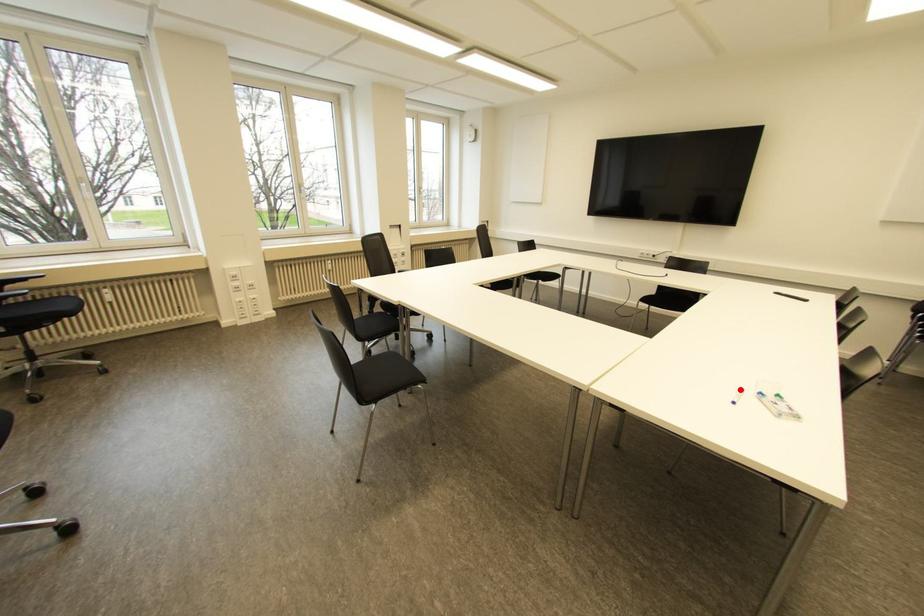
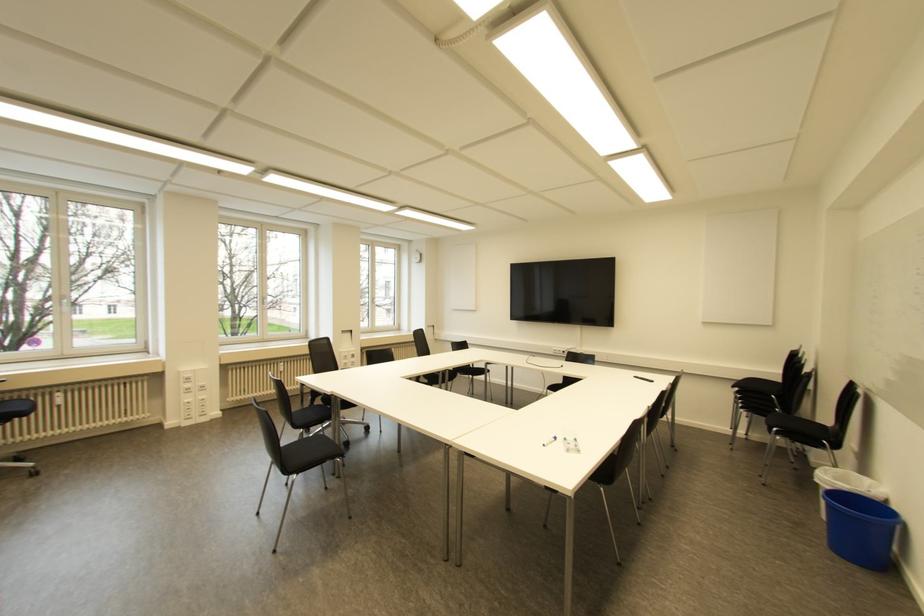
Question: I am providing you with two images of the same scene from different viewpoints. Image1 has a red point marked. In image2, the corresponding 3D location appears at what relative position? Reply with the corresponding letter.

Choices:
 (A) Closer
 (B) Farther

Answer: (A)